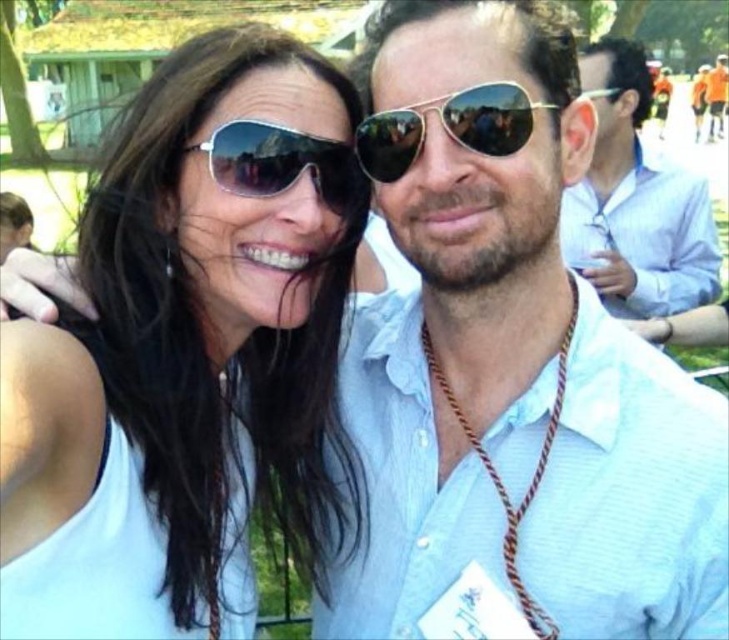
Question: Which point is closer to the camera?

Choices:
 (A) matte white shirt at center
 (B) gold reflective aviator sunglasses at center

Answer: (A)

Question: Which object is the closest to the matte white tank top at center?

Choices:
 (A) matte white shirt at center
 (B) gold reflective aviator sunglasses at center

Answer: (A)

Question: Can you confirm if sunglasses at center is positioned to the right of matte orange shirt at upper right?

Choices:
 (A) yes
 (B) no

Answer: (B)

Question: Is the position of matte white tank top at center more distant than that of light blue shirt at right?

Choices:
 (A) no
 (B) yes

Answer: (A)

Question: Can you confirm if matte white tank top at center is wider than gold reflective aviator sunglasses at center?

Choices:
 (A) yes
 (B) no

Answer: (A)

Question: Based on their relative distances, which object is nearer to the matte white tank top at center?

Choices:
 (A) gold reflective aviator sunglasses at center
 (B) matte orange shirt at upper right

Answer: (A)